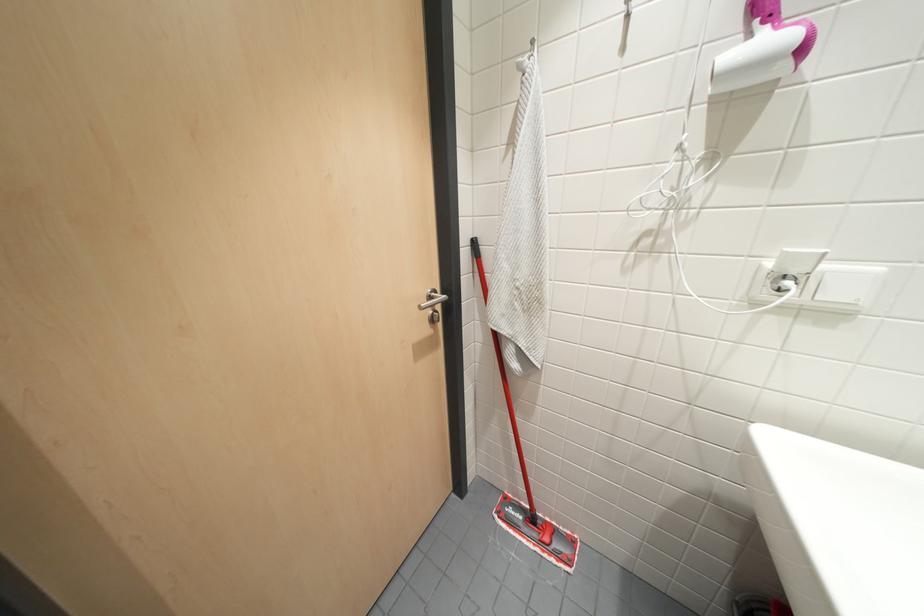
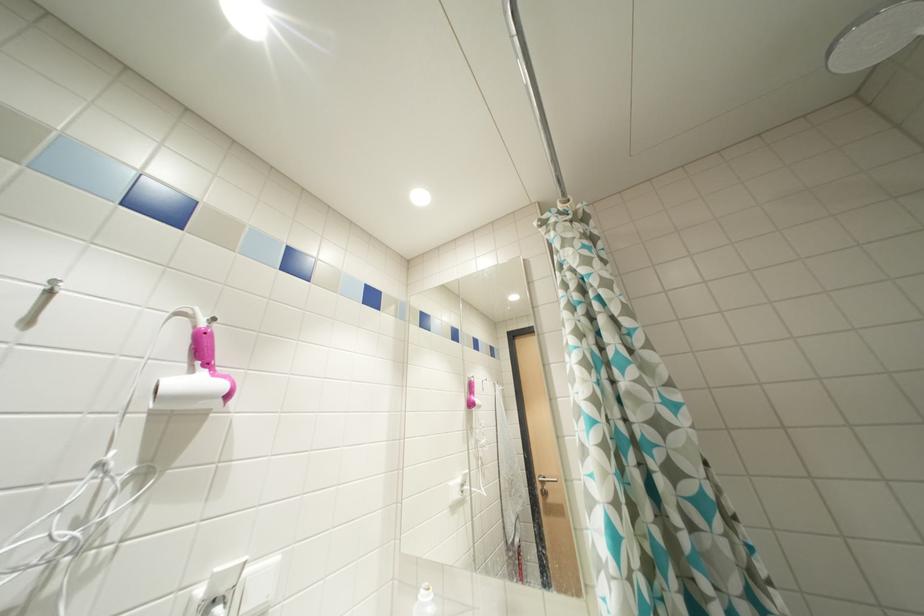
The images are taken continuously from a first-person perspective. In which direction is your viewpoint rotating?

The camera rotated toward right-up.